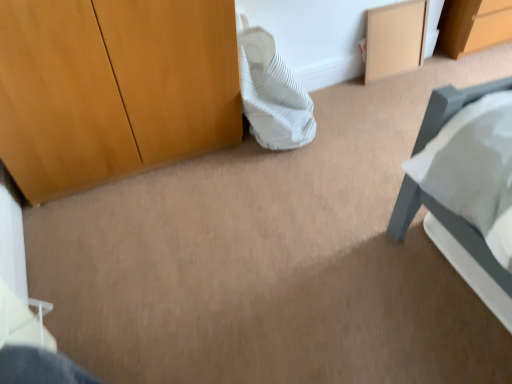
Question: Can you see beige matte cabinet at upper right touching white striped pillow at center?

Choices:
 (A) yes
 (B) no

Answer: (B)

Question: Is beige matte cabinet at upper right oriented towards white striped pillow at center?

Choices:
 (A) yes
 (B) no

Answer: (B)

Question: Can you confirm if beige matte cabinet at upper right is positioned to the left of white striped pillow at center?

Choices:
 (A) yes
 (B) no

Answer: (B)

Question: Is beige matte cabinet at upper right positioned behind white striped pillow at center?

Choices:
 (A) no
 (B) yes

Answer: (B)

Question: From a real-world perspective, is beige matte cabinet at upper right under white striped pillow at center?

Choices:
 (A) yes
 (B) no

Answer: (A)

Question: From the image's perspective, is beige matte cabinet at upper right below white striped pillow at center?

Choices:
 (A) no
 (B) yes

Answer: (A)

Question: Can you confirm if white striped pillow at center is shorter than beige matte cabinet at upper right?

Choices:
 (A) no
 (B) yes

Answer: (A)

Question: From a real-world perspective, is white striped pillow at center below beige matte cabinet at upper right?

Choices:
 (A) yes
 (B) no

Answer: (B)

Question: Considering the relative positions of white striped pillow at center and beige matte cabinet at upper right in the image provided, is white striped pillow at center to the right of beige matte cabinet at upper right from the viewer's perspective?

Choices:
 (A) no
 (B) yes

Answer: (A)

Question: From the image's perspective, is white striped pillow at center under beige matte cabinet at upper right?

Choices:
 (A) yes
 (B) no

Answer: (A)

Question: Does white striped pillow at center have a lesser width compared to beige matte cabinet at upper right?

Choices:
 (A) no
 (B) yes

Answer: (A)

Question: Is white striped pillow at center with beige matte cabinet at upper right?

Choices:
 (A) yes
 (B) no

Answer: (B)

Question: Based on their positions, is beige matte cabinet at upper right located to the left or right of white striped pillow at center?

Choices:
 (A) left
 (B) right

Answer: (B)